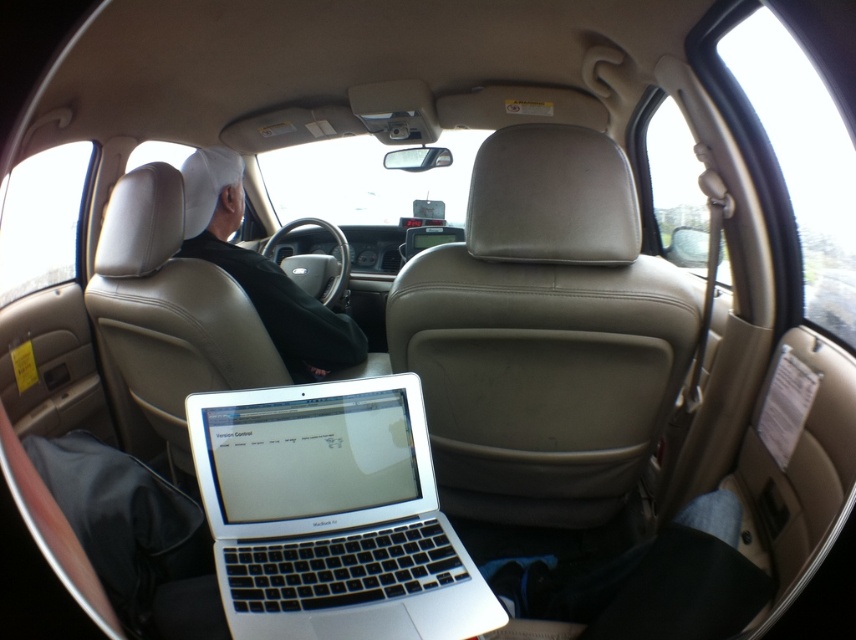
You are a passenger in the back seat of this car and need to place a small bag on the seat next to you. Considering the silver metallic laptop at center and the white leather jacket at upper left, which object takes up more space and is therefore less ideal for placing your bag?

The white leather jacket at upper left occupies more space than the silver metallic laptop at center, so it is less ideal for placing your bag.

You are sitting in the back seat of a car and see the silver metallic laptop at center and the white leather jacket at upper left. Which object is shorter in height?

The silver metallic laptop at center is not as tall as the white leather jacket at upper left, so the silver metallic laptop at center is shorter in height.

You are sitting in the back seat of the car and want to hand a USB drive to the passenger. The USB drive is currently on the silver metallic laptop at center. To reach the passenger, you need to move the USB drive from the laptop to their jacket pocket. Which direction should you move the USB drive relative to the white leather jacket at upper left?

The silver metallic laptop at center is positioned under the white leather jacket at upper left. To move the USB drive to the passenger, you should move it upward towards the white leather jacket at upper left.